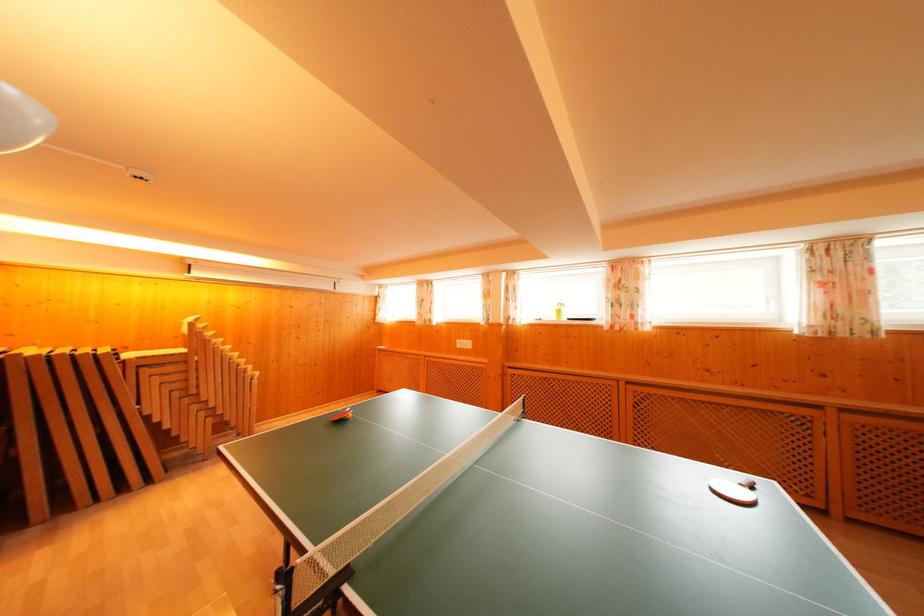
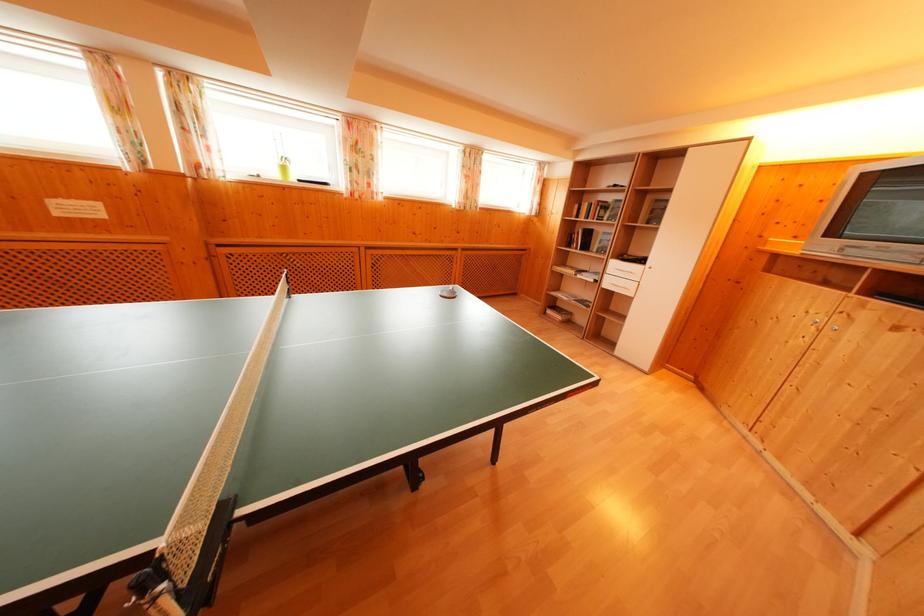
The point at (564, 317) is marked in the first image. Where is the corresponding point in the second image?

(288, 174)